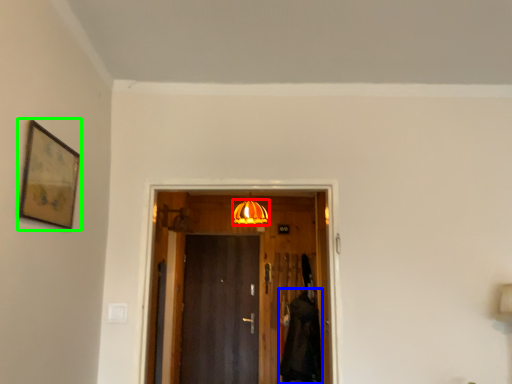
Question: Considering the real-world distances, which object is farthest from lamp (highlighted by a red box)? robe (highlighted by a blue box) or picture frame (highlighted by a green box)?

Choices:
 (A) robe
 (B) picture frame

Answer: (B)